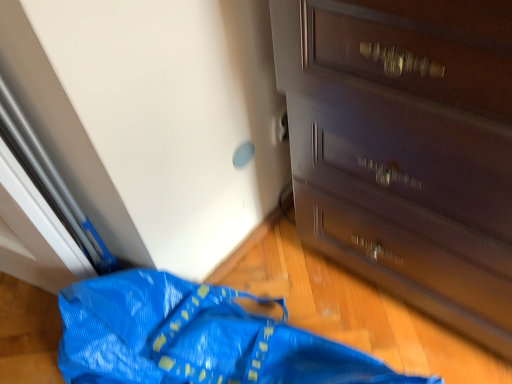
Describe the element at coordinates (406, 149) in the screenshot. I see `dark wood chest of drawers at right` at that location.

At what (x,y) coordinates should I click in order to perform the action: click on dark wood chest of drawers at right. Please return your answer as a coordinate pair (x, y). The image size is (512, 384). Looking at the image, I should click on (406, 149).

What is the approximate height of dark wood chest of drawers at right?

dark wood chest of drawers at right is 27.98 inches tall.

Find the location of a particular element. The height and width of the screenshot is (384, 512). dark wood chest of drawers at right is located at coordinates [x=406, y=149].